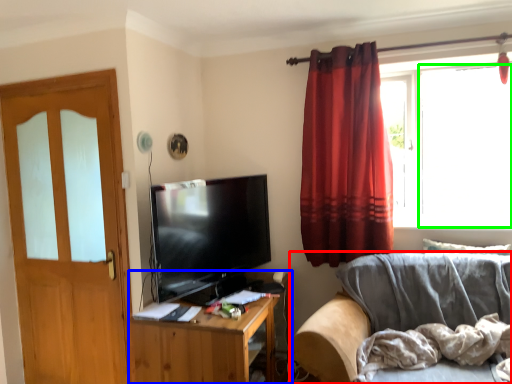
Question: Based on their relative distances, which object is farther from studio couch (highlighted by a red box)? Choose from cabinetry (highlighted by a blue box) and window screen (highlighted by a green box).

Choices:
 (A) cabinetry
 (B) window screen

Answer: (B)